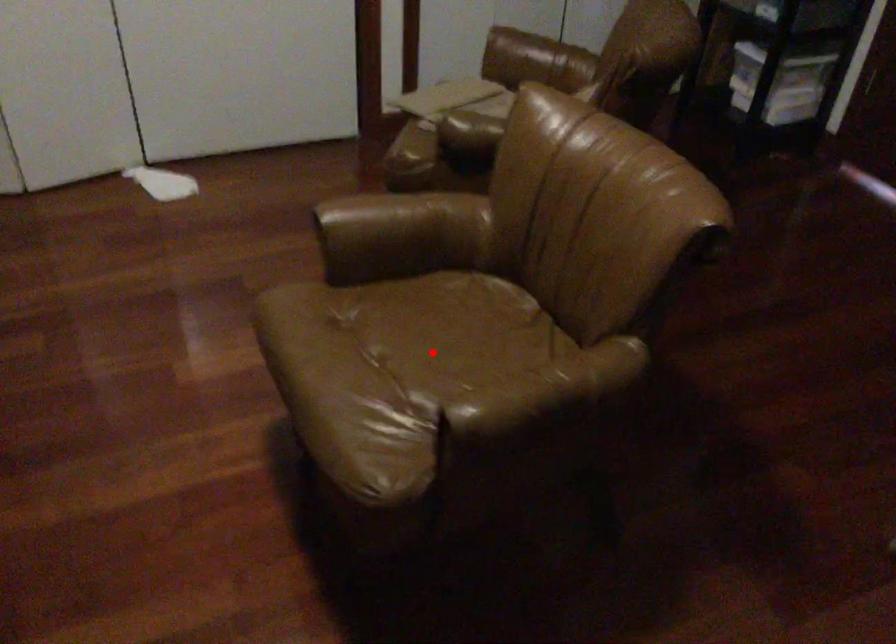
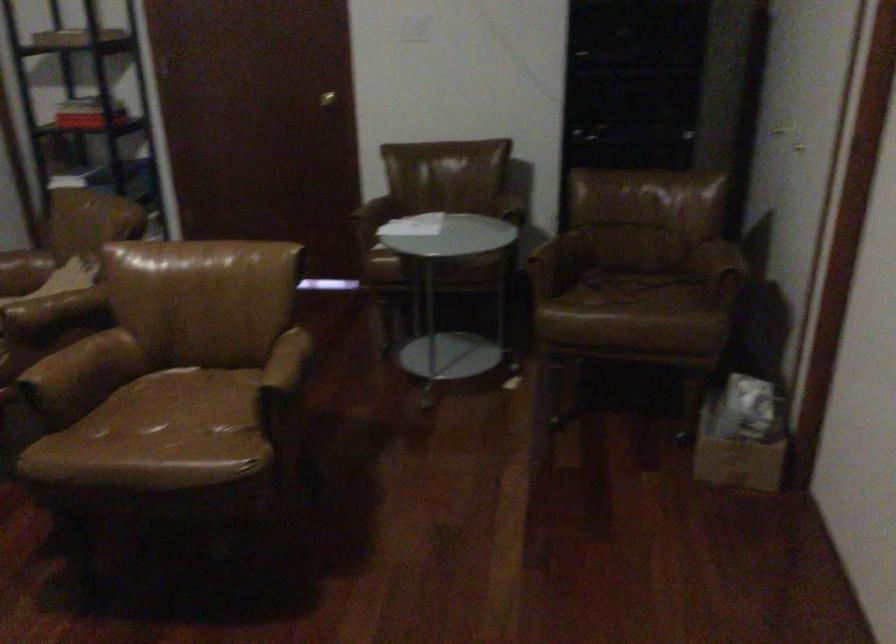
Locate, in the second image, the point that corresponds to the highlighted location in the first image.

(178, 413)